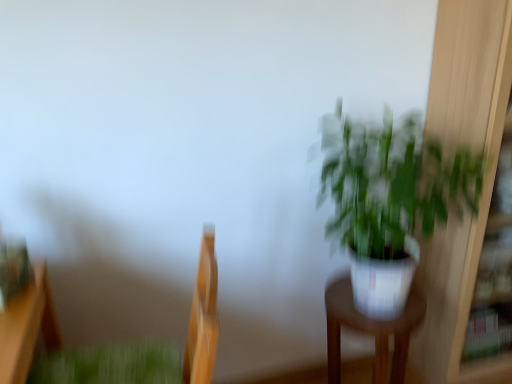
Question: From a real-world perspective, is white glossy pot at center-right physically located above or below white glossy pot at right?

Choices:
 (A) above
 (B) below

Answer: (B)

Question: Considering their positions, is white glossy pot at center-right located in front of or behind white glossy pot at right?

Choices:
 (A) front
 (B) behind

Answer: (B)

Question: Which object is positioned farthest from the white glossy pot at right?

Choices:
 (A) white glossy pot at center-right
 (B) green matte plant at lower left
 (C) wooden swivel chair at left

Answer: (C)

Question: Considering the real-world distances, which object is closest to the wooden swivel chair at left?

Choices:
 (A) green matte plant at lower left
 (B) white glossy pot at center-right
 (C) white glossy pot at right

Answer: (A)